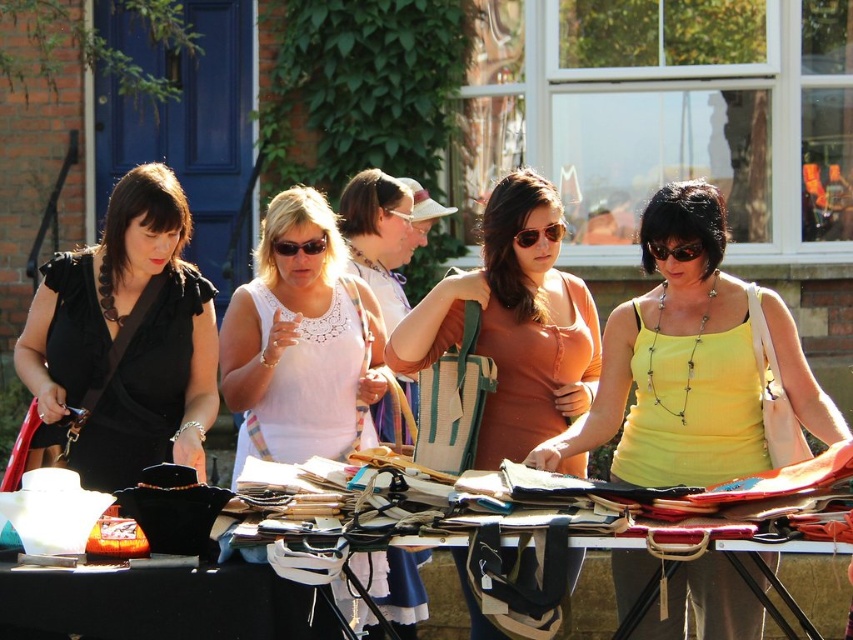
Between matte black dress at left and matte orange tank top at center, which one appears on the left side from the viewer's perspective?

Positioned to the left is matte black dress at left.

Does matte black dress at left appear on the left side of matte orange tank top at center?

Correct, you'll find matte black dress at left to the left of matte orange tank top at center.

I want to click on matte black dress at left, so click(125, 340).

Where is `matte black dress at left`? matte black dress at left is located at coordinates (125, 340).

Describe the element at coordinates (381, 234) in the screenshot. I see `matte brown purse at center` at that location.

What are the coordinates of `matte brown purse at center` in the screenshot? It's located at (381, 234).

Where is `white lace tank top at center`? The image size is (853, 640). white lace tank top at center is located at coordinates (302, 342).